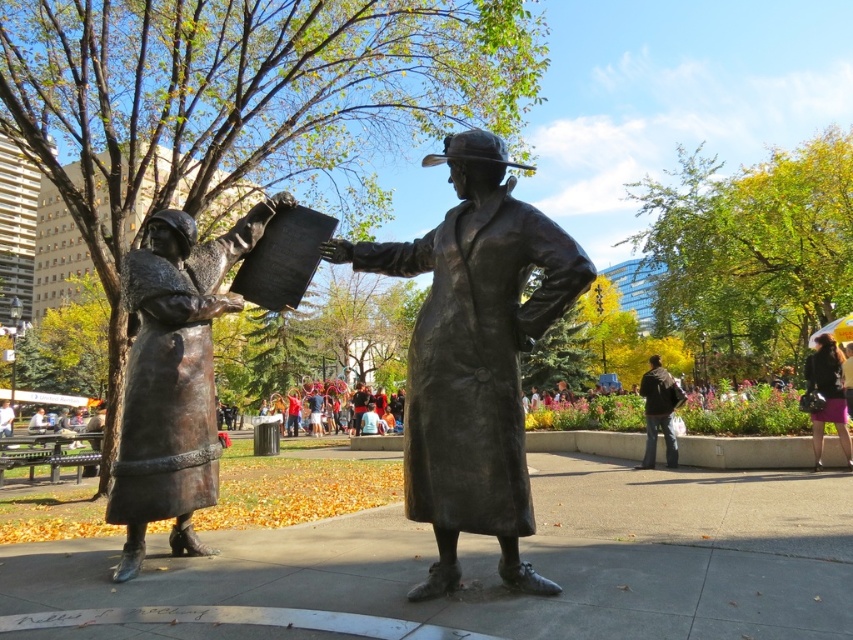
Can you confirm if matte black jacket at lower right is wider than dark brown leather jacket at lower right?

Correct, the width of matte black jacket at lower right exceeds that of dark brown leather jacket at lower right.

Which is behind, point (834, 422) or point (674, 467)?

The point (674, 467) is more distant.

You are a GUI agent. You are given a task and a screenshot of the screen. Output one action in this format:
    pyautogui.click(x=<x>, y=<y>)
    Task: Click on the matte black jacket at lower right
    This screenshot has width=853, height=640.
    Given the screenshot: What is the action you would take?
    pyautogui.click(x=827, y=396)

Does bronze statue at center appear on the left side of bronze statue at left?

Incorrect, bronze statue at center is not on the left side of bronze statue at left.

Is point (500, 320) closer to viewer compared to point (155, 321)?

Yes, it is in front of point (155, 321).

The height and width of the screenshot is (640, 853). Identify the location of bronze statue at center. (474, 355).

Based on the photo, is bronze statue at left to the left of matte black jacket at lower right from the viewer's perspective?

Correct, you'll find bronze statue at left to the left of matte black jacket at lower right.

Is point (198, 451) in front of point (816, 445)?

Yes.

Where is `bronze statue at left`? bronze statue at left is located at coordinates (173, 378).